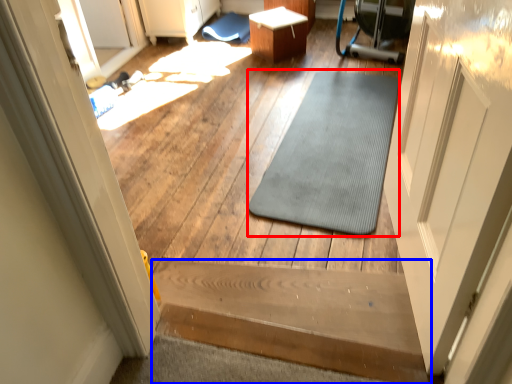
Question: Among these objects, which one is nearest to the camera, mat (highlighted by a red box) or stairs (highlighted by a blue box)?

Choices:
 (A) mat
 (B) stairs

Answer: (B)